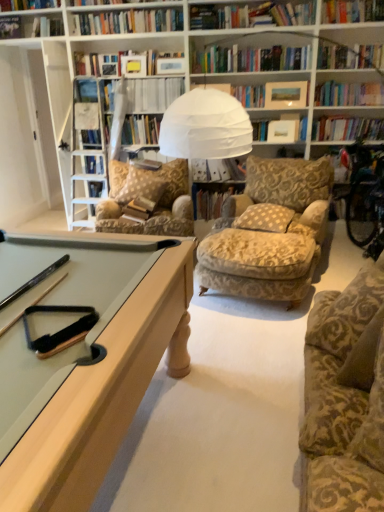
Question: Is hardcover book at center, positioned as the 1th book in bottom-to-top order, wider or thinner than gold-patterned fabric chair at center?

Choices:
 (A) wide
 (B) thin

Answer: (B)

Question: Considering the relative positions of hardcover book at center, which appears as the fourth book when viewed from the top, and gold-patterned fabric chair at center in the image provided, is hardcover book at center, which appears as the fourth book when viewed from the top, to the left or to the right of gold-patterned fabric chair at center?

Choices:
 (A) right
 (B) left

Answer: (A)

Question: Which object is positioned farthest from the gold-patterned fabric chair at center?

Choices:
 (A) patterned fabric pillow at center, arranged as the 2th pillow when viewed from the left
 (B) hardcover book at upper center, the first book when ordered from top to bottom
 (C) white paper at upper center, arranged as the third book when ordered from the bottom
 (D) hardcover book at center, positioned as the 1th book in bottom-to-top order
 (E) hardcover book at center, which appears as the third book when viewed from the top

Answer: (B)

Question: Which object is positioned closest to the patterned fabric pillow at center, positioned as the 1th pillow in left-to-right order?

Choices:
 (A) hardcover book at upper center, which is the 4th book from bottom to top
 (B) patterned fabric pillow at center, acting as the 1th pillow starting from the right
 (C) white paper at upper center, arranged as the second book when viewed from the top
 (D) gold-patterned fabric chair at center
 (E) hardcover book at center, which is the second book from bottom to top

Answer: (D)